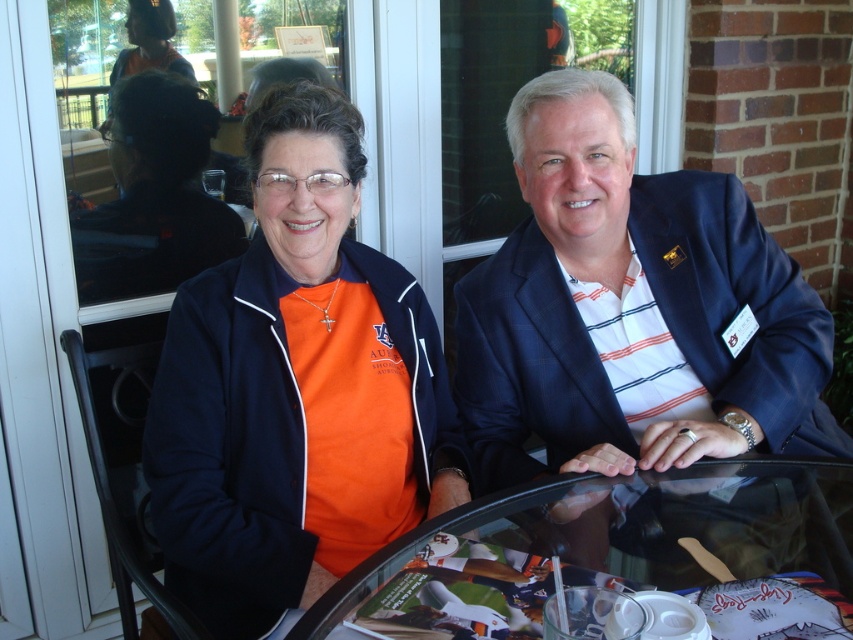
You are a photographer trying to capture a clear shot of the blue fabric suit at center without the transparent glass table at center reflecting in the background. What should you do to avoid the reflection?

The blue fabric suit at center is positioned over the transparent glass table at center, so you can adjust your angle to avoid the reflection by shooting from above or below the table surface where the glass is less likely to reflect light.

You are a photographer trying to capture a photo of the blue fabric suit at center. Based on the coordinates provided in the Objects Description, can you determine if the suit is positioned centrally within the frame?

The blue fabric suit at center is located at point (631, 308), which is very close to the center coordinates of (426, 320). Therefore, the suit is positioned centrally within the frame.

You are a photographer taking a picture of the orange fabric shirt at center and the transparent glass table at center. Which object will be more visible in the photo?

The orange fabric shirt at center is positioned over transparent glass table at center, so the orange fabric shirt at center will be more visible in the photo because it is placed on top of the transparent table.